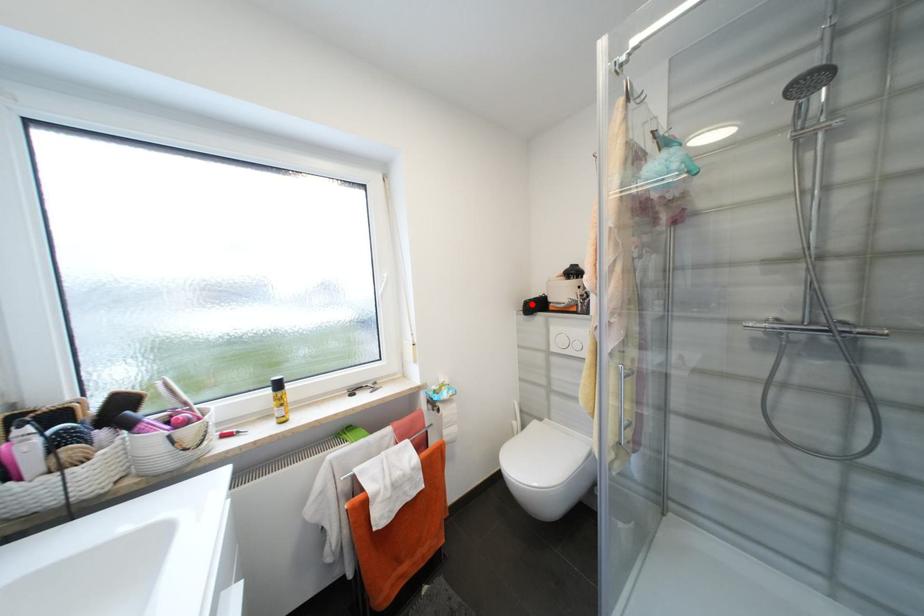
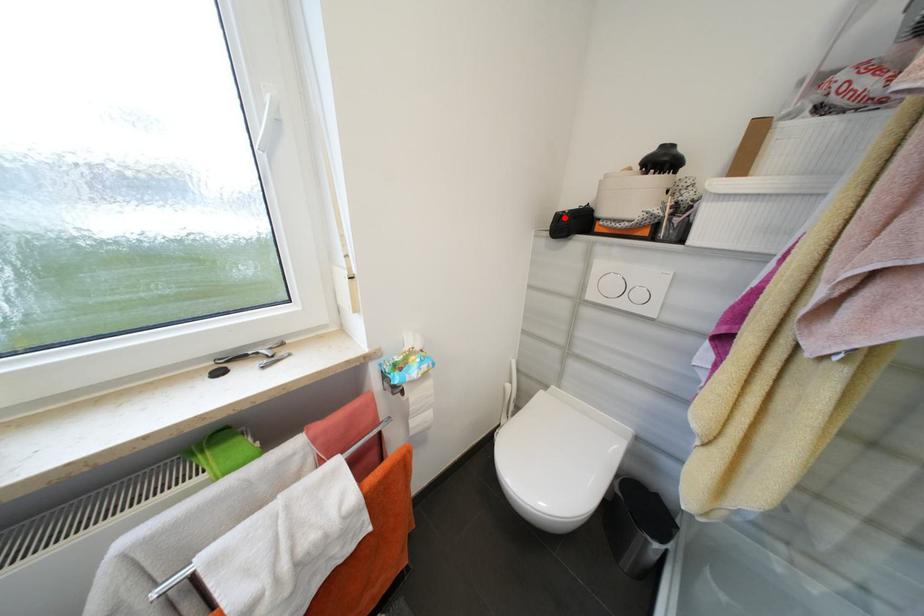
I am providing you with two images of the same scene from different viewpoints. A red point is marked on the first image and another point is marked on the second image. Is the marked point in image1 the same physical position as the marked point in image2?

Yes